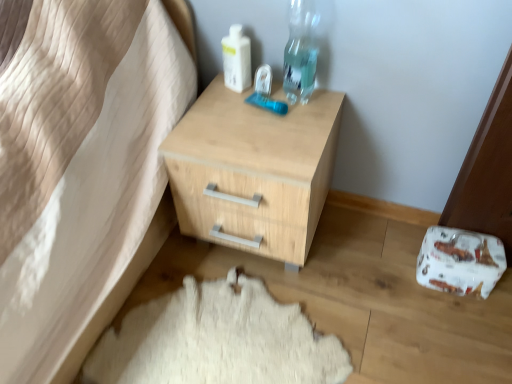
You are a GUI agent. You are given a task and a screenshot of the screen. Output one action in this format:
    pyautogui.click(x=<x>, y=<y>)
    Task: Click on the free location to the right of natural wood chest of drawers at center
    The image size is (512, 384).
    Given the screenshot: What is the action you would take?
    pyautogui.click(x=369, y=249)